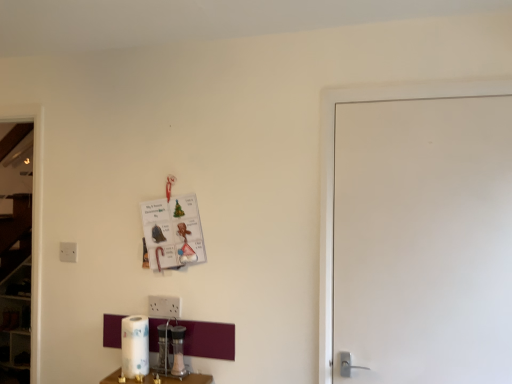
Where is `vacant space to the right of white glossy paper towel at lower center`? vacant space to the right of white glossy paper towel at lower center is located at coordinates (170, 376).